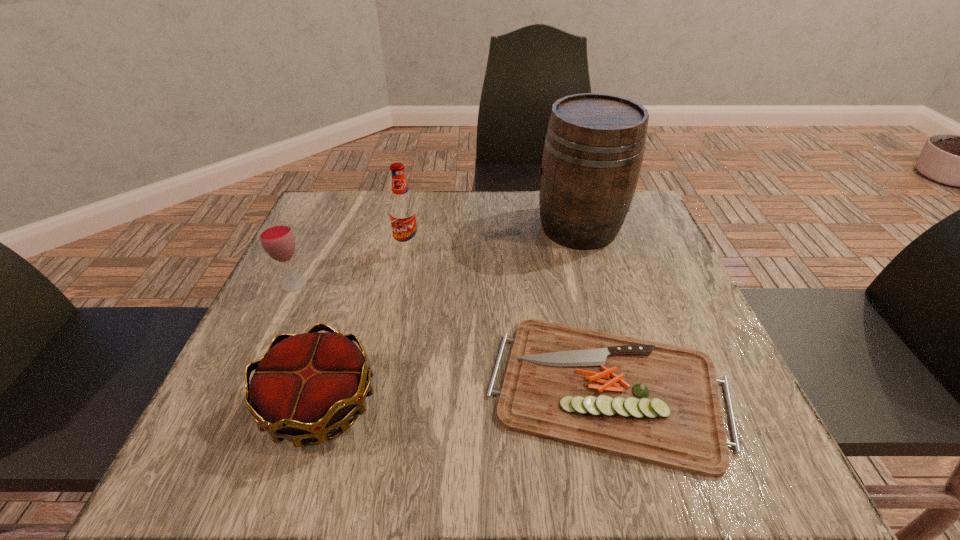
The width and height of the screenshot is (960, 540). Identify the location of chopping board at the right edge. (657, 403).

At what (x,y) coordinates should I click in order to perform the action: click on object at the near left corner. Please return your answer as a coordinate pair (x, y). The width and height of the screenshot is (960, 540). Looking at the image, I should click on (306, 385).

You are a GUI agent. You are given a task and a screenshot of the screen. Output one action in this format:
    pyautogui.click(x=<x>, y=<y>)
    Task: Click on the object located in the far right corner section of the desktop
    Image resolution: width=960 pixels, height=540 pixels.
    Given the screenshot: What is the action you would take?
    pyautogui.click(x=594, y=145)

Where is `object located at the near right corner`? The image size is (960, 540). object located at the near right corner is located at coordinates (657, 403).

I want to click on vacant point at the far edge, so click(x=530, y=214).

Find the location of a particular element. vacant area at the near edge is located at coordinates (337, 464).

At what (x,y) coordinates should I click in order to perform the action: click on vacant region at the right edge of the desktop. Please return your answer as a coordinate pair (x, y). Looking at the image, I should click on (685, 302).

At what (x,y) coordinates should I click in order to perform the action: click on vacant space at the far right corner of the desktop. Please return your answer as a coordinate pair (x, y). Looking at the image, I should click on (640, 210).

At what (x,y) coordinates should I click in order to perform the action: click on free space between the fourth shortest object and the shortest object. Please return your answer as a coordinate pair (x, y). The height and width of the screenshot is (540, 960). Looking at the image, I should click on (508, 319).

Locate an element on the screen. vacant point located between the third nearest object and the cider is located at coordinates 437,255.